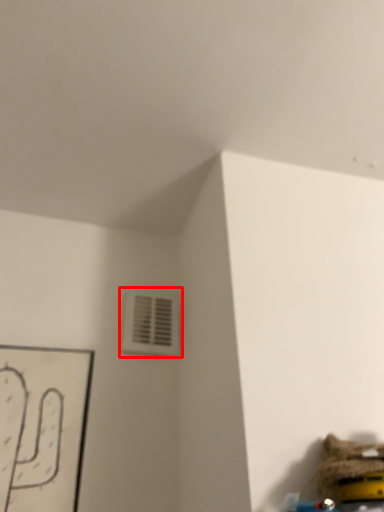
Question: Where is air conditioning (annotated by the red box) located in relation to toy in the image?

Choices:
 (A) left
 (B) right

Answer: (A)